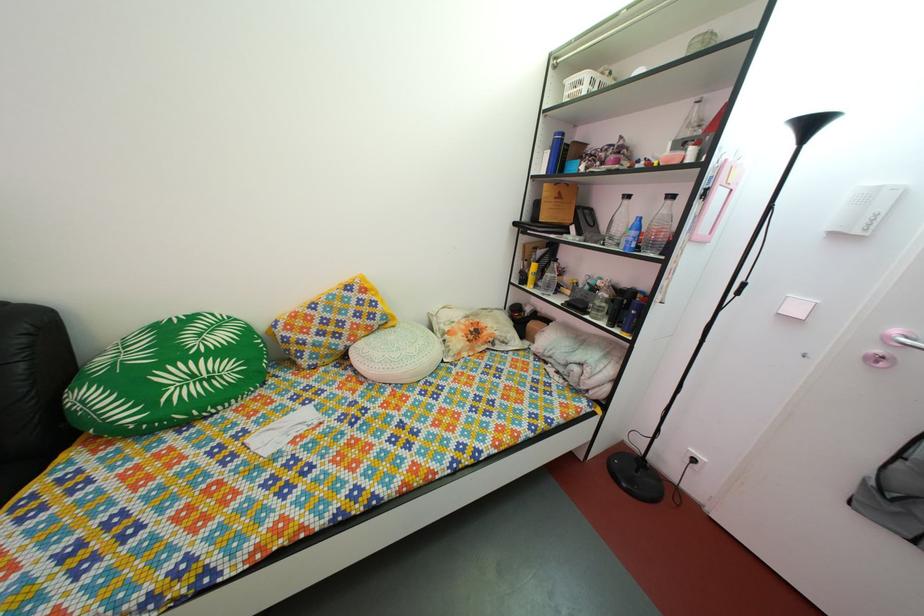
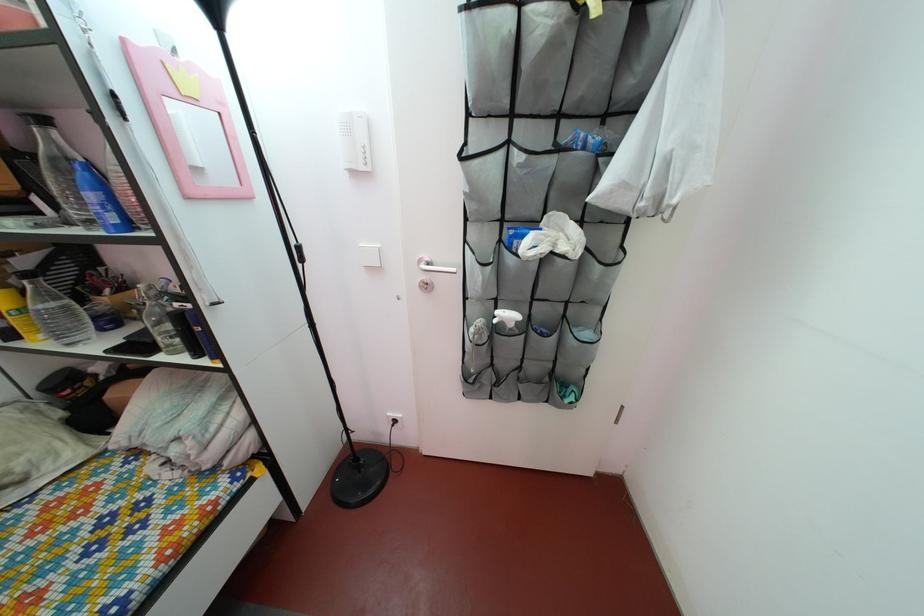
Find the pixel in the second image that matches pixel 540 286 in the first image.

(27, 330)